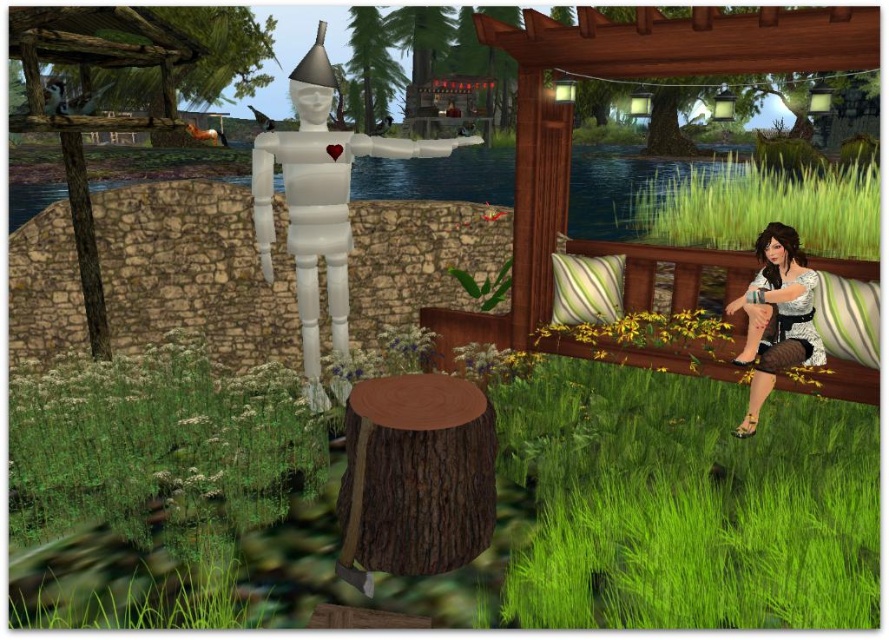
Looking at this image, you are a character in this scene and want to hide behind the green grass at upper center. Can you hide behind it if you stand behind the transparent plastic figure at center?

The transparent plastic figure at center is in front of green grass at upper center, so standing behind it would still leave you in front of the green grass at upper center. Therefore, you cannot effectively hide behind the green grass at upper center this way.

You are standing in the center of the scene and want to place a decorative stone exactly at the coordinates mentioned for the brown wood stump at center. What are the coordinates where you should place the stone?

The coordinates for the brown wood stump at center are point (417, 474), so you should place the decorative stone there.

You are standing at the center of the scene and want to place a small potted plant between the green grass at lower right and the green striped cushion at upper right. Based on their positions, where should you place the potted plant?

The green grass at lower right is to the right of the green striped cushion at upper right, so you should place the potted plant to the left of the green grass at lower right and to the right of the green striped cushion at upper right.